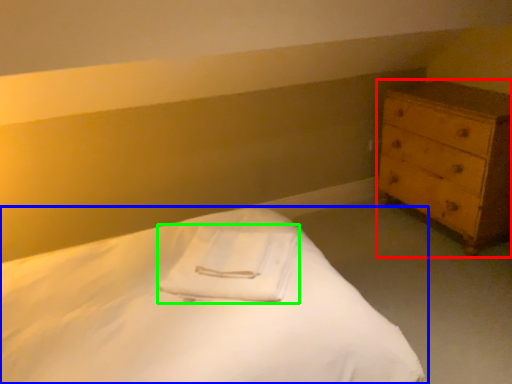
Question: Estimate the real-world distances between objects in this image. Which object is farther from chest of drawers (highlighted by a red box), bed (highlighted by a blue box) or cloth (highlighted by a green box)?

Choices:
 (A) bed
 (B) cloth

Answer: (A)